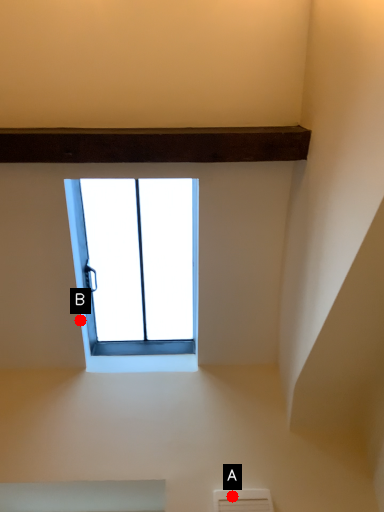
Question: Two points are circled on the image, labeled by A and B beside each circle. Which point is farther from the camera taking this photo?

Choices:
 (A) A is further
 (B) B is further

Answer: (B)